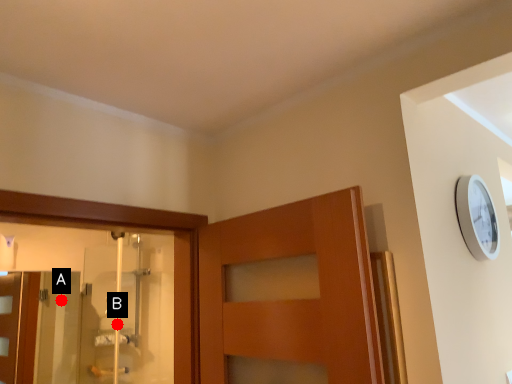
Question: Two points are circled on the image, labeled by A and B beside each circle. Which point is farther to the camera?

Choices:
 (A) A is further
 (B) B is further

Answer: (A)